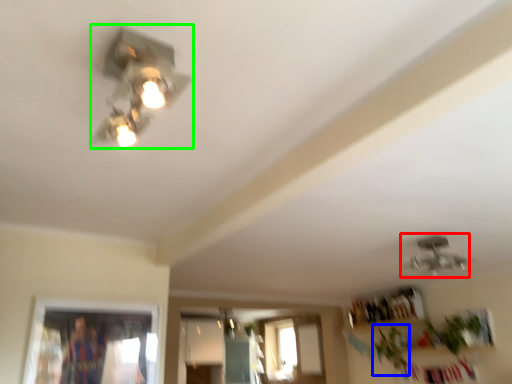
Question: Which is farther away from lamp (highlighted by a red box)? plant (highlighted by a blue box) or lamp (highlighted by a green box)?

Choices:
 (A) plant
 (B) lamp

Answer: (B)